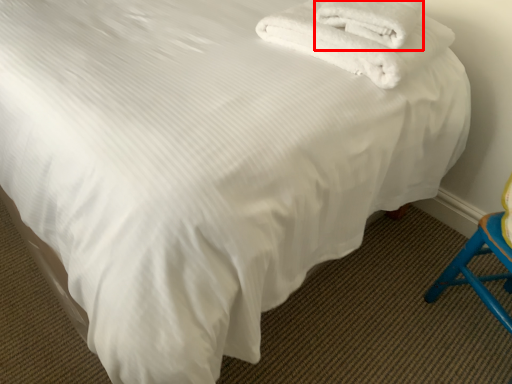
Question: In this image, where is towel (annotated by the red box) located relative to towel?

Choices:
 (A) right
 (B) left

Answer: (A)